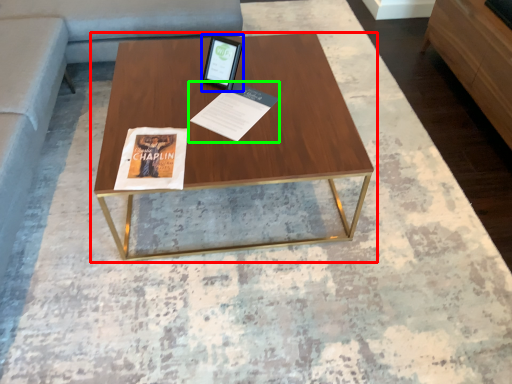
Question: Which object is the farthest from coffee table (highlighted by a red box)? Choose among these: tablet computer (highlighted by a blue box) or magazine (highlighted by a green box).

Choices:
 (A) tablet computer
 (B) magazine

Answer: (A)